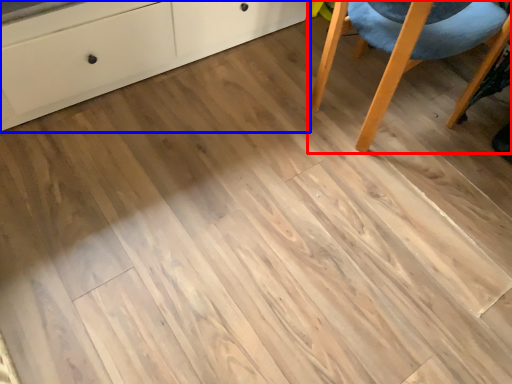
Question: Among these objects, which one is nearest to the camera, chair (highlighted by a red box) or chest of drawers (highlighted by a blue box)?

Choices:
 (A) chair
 (B) chest of drawers

Answer: (B)